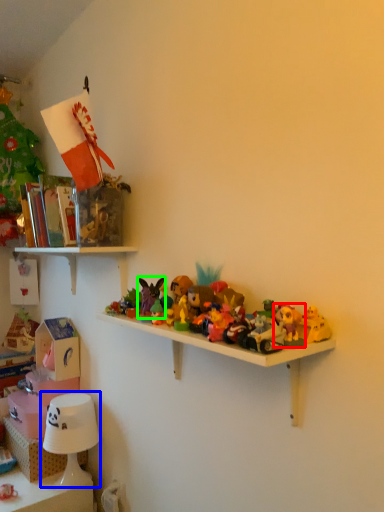
Question: Based on their relative distances, which object is nearer to toy (highlighted by a red box)? Choose from table lamp (highlighted by a blue box) and toy (highlighted by a green box).

Choices:
 (A) table lamp
 (B) toy

Answer: (B)